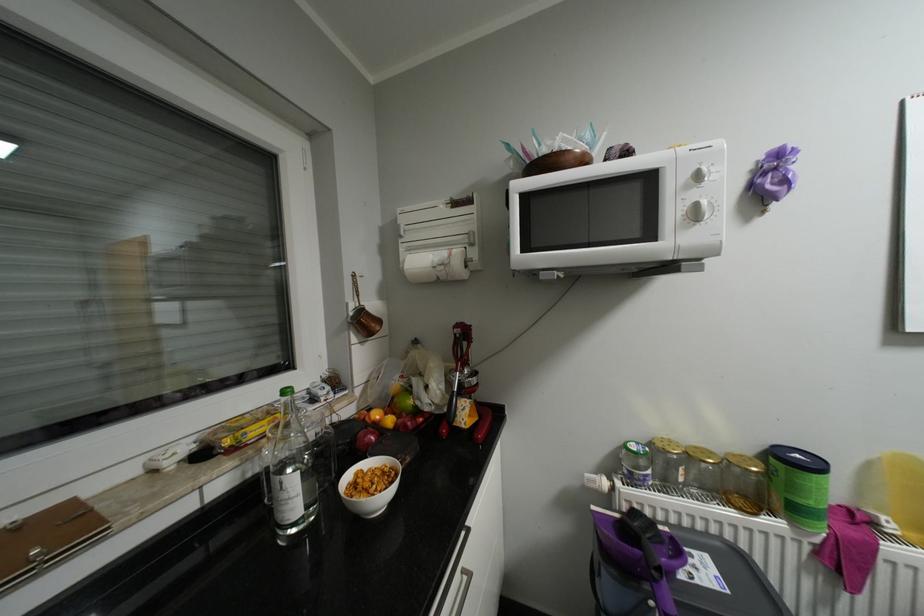
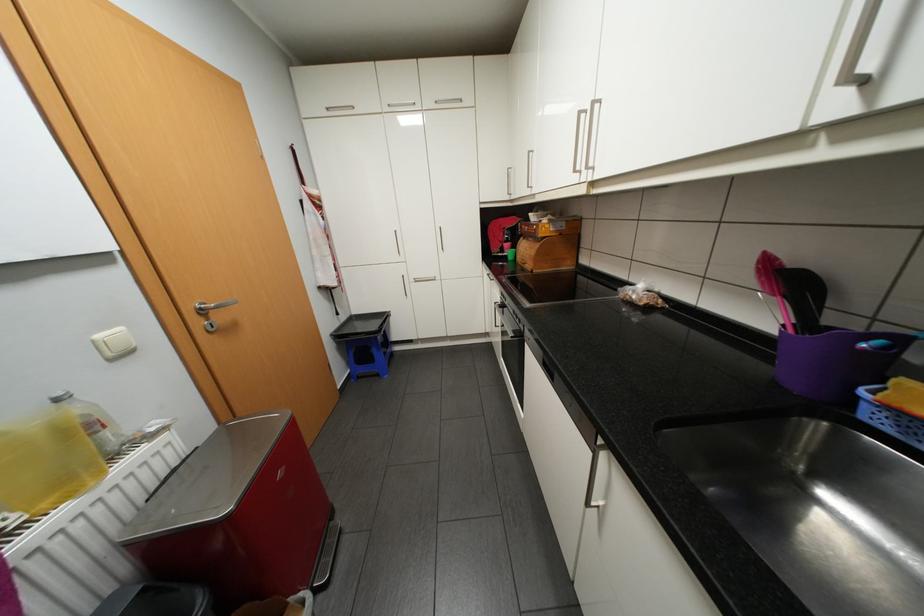
Based on the continuous images, in which direction is the camera rotating?

The camera's rotation is toward right-down.